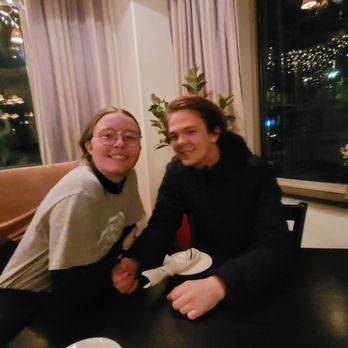
Locate an element on the screen. black table is located at coordinates click(x=340, y=274).